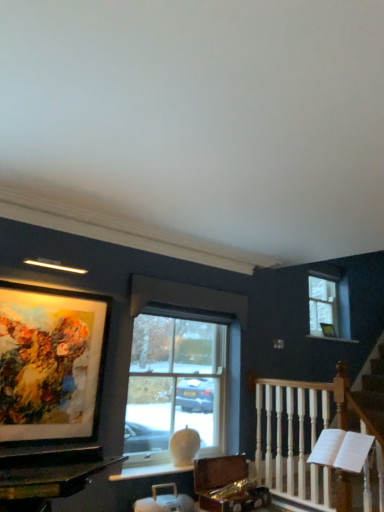
Image resolution: width=384 pixels, height=512 pixels. What do you see at coordinates (328, 306) in the screenshot?
I see `clear glass window at upper right, which is the first window in right-to-left order` at bounding box center [328, 306].

Image resolution: width=384 pixels, height=512 pixels. In order to click on matte glass picture frame at upper left in this screenshot , I will do `click(48, 365)`.

Identify the location of white wooden railing at right. The width and height of the screenshot is (384, 512). (317, 440).

In order to click on clear glass window at upper right, the 2th window viewed from the front in this screenshot , I will do `click(328, 306)`.

Which is behind, white wooden railing at right or white marble window sill at upper center?

white marble window sill at upper center is behind.

Is white wooden railing at right positioned far away from white marble window sill at upper center?

Absolutely, white wooden railing at right is distant from white marble window sill at upper center.

The image size is (384, 512). I want to click on window sill that appears behind the white wooden railing at right, so click(333, 338).

Who is shorter, white marble window sill at upper center or clear glass window at center, which is counted as the 1th window, starting from the left?

Standing shorter between the two is white marble window sill at upper center.

Does point (310, 337) appear closer or farther from the camera than point (227, 410)?

Point (310, 337) is farther from the camera than point (227, 410).

This screenshot has height=512, width=384. Identify the location of window below the white marble window sill at upper center (from a real-world perspective). (182, 370).

Can you confirm if white marble window sill at upper center is thinner than clear glass window at center, which is the 2th window from right to left?

Incorrect, the width of white marble window sill at upper center is not less than that of clear glass window at center, which is the 2th window from right to left.

You are a GUI agent. You are given a task and a screenshot of the screen. Output one action in this format:
    pyautogui.click(x=<x>, y=<y>)
    Task: Click on the picture frame in front of the clear glass window at center, acting as the 1th window starting from the front
    The width and height of the screenshot is (384, 512).
    Given the screenshot: What is the action you would take?
    pyautogui.click(x=48, y=365)

Is point (71, 308) behind point (131, 390)?

No, it is in front of (131, 390).

Can you see matte glass picture frame at upper left touching clear glass window at center, which is the 2th window from right to left?

matte glass picture frame at upper left and clear glass window at center, which is the 2th window from right to left, are not in contact.

From the image's perspective, is matte glass picture frame at upper left above or below clear glass window at center, acting as the 1th window starting from the front?

matte glass picture frame at upper left is situated higher than clear glass window at center, acting as the 1th window starting from the front, in the image.

From a real-world perspective, which is physically above, matte glass picture frame at upper left or white marble window sill at upper center?

white marble window sill at upper center.

What's the angular difference between matte glass picture frame at upper left and white marble window sill at upper center's facing directions?

The angular difference between matte glass picture frame at upper left and white marble window sill at upper center is 0.00898 degrees.

Looking at this image, which object is further away from the camera taking this photo, matte glass picture frame at upper left or white marble window sill at upper center?

white marble window sill at upper center.

Would you say matte glass picture frame at upper left is to the left or to the right of white marble window sill at upper center in the picture?

In the image, matte glass picture frame at upper left appears on the left side of white marble window sill at upper center.

How far apart are white marble window sill at upper center and matte glass picture frame at upper left?

The distance of white marble window sill at upper center from matte glass picture frame at upper left is 9.56 feet.

Does point (317, 336) come farther from viewer compared to point (94, 403)?

Yes, point (317, 336) is behind point (94, 403).

From a real-world perspective, which is physically above, white marble window sill at upper center or matte glass picture frame at upper left?

white marble window sill at upper center.

Would you say clear glass window at center, which is the 2th window from right to left, is to the left or to the right of white wooden railing at right in the picture?

clear glass window at center, which is the 2th window from right to left, is to the left of white wooden railing at right.

From a real-world perspective, who is located lower, clear glass window at center, which is counted as the 1th window, starting from the left, or white wooden railing at right?

From a 3D spatial view, white wooden railing at right is below.

Based on the photo, can we say clear glass window at center, which is counted as the 1th window, starting from the left, lies outside white wooden railing at right?

Indeed, clear glass window at center, which is counted as the 1th window, starting from the left, is completely outside white wooden railing at right.

Is clear glass window at center, which is the 2th window from right to left, aimed at white wooden railing at right?

Yes, clear glass window at center, which is the 2th window from right to left, is oriented towards white wooden railing at right.

In the scene shown: Is white wooden railing at right oriented towards matte glass picture frame at upper left?

No, white wooden railing at right is not aimed at matte glass picture frame at upper left.

Which object is closer to the camera taking this photo, white wooden railing at right or matte glass picture frame at upper left?

Positioned in front is matte glass picture frame at upper left.

Identify the location of rail below the matte glass picture frame at upper left (from the image's perspective). (317, 440).

Find the location of `rail below the white marble window sill at upper center (from the image's perspective)`. rail below the white marble window sill at upper center (from the image's perspective) is located at coordinates (317, 440).

What are the coordinates of `window in front of the white marble window sill at upper center` in the screenshot? It's located at (182, 370).

Based on their spatial positions, is matte glass picture frame at upper left or clear glass window at center, the 2th window viewed from the back, further from white wooden railing at right?

matte glass picture frame at upper left lies further to white wooden railing at right than the other object.

When comparing their distances from clear glass window at center, acting as the 1th window starting from the front, does clear glass window at upper right, the 2th window positioned from the left, or white marble window sill at upper center seem further?

white marble window sill at upper center lies further to clear glass window at center, acting as the 1th window starting from the front, than the other object.

Estimate the real-world distances between objects in this image. Which object is further from clear glass window at upper right, which is the first window from back to front, clear glass window at center, which is the 2th window from right to left, or white wooden railing at right?

clear glass window at center, which is the 2th window from right to left, lies further to clear glass window at upper right, which is the first window from back to front, than the other object.

Looking at the image, which one is located closer to clear glass window at center, which is counted as the 1th window, starting from the left, matte glass picture frame at upper left or white marble window sill at upper center?

matte glass picture frame at upper left lies closer to clear glass window at center, which is counted as the 1th window, starting from the left, than the other object.

Based on their spatial positions, is white marble window sill at upper center or white wooden railing at right further from matte glass picture frame at upper left?

Based on the image, white marble window sill at upper center appears to be further to matte glass picture frame at upper left.

Based on their spatial positions, is clear glass window at center, acting as the 1th window starting from the front, or white marble window sill at upper center further from white wooden railing at right?

Among the two, white marble window sill at upper center is located further to white wooden railing at right.

Looking at the image, which one is located further to white marble window sill at upper center, clear glass window at center, which is counted as the 1th window, starting from the left, or white wooden railing at right?

Among the two, clear glass window at center, which is counted as the 1th window, starting from the left, is located further to white marble window sill at upper center.

Estimate the real-world distances between objects in this image. Which object is closer to matte glass picture frame at upper left, clear glass window at upper right, which is the first window from back to front, or white marble window sill at upper center?

clear glass window at upper right, which is the first window from back to front, lies closer to matte glass picture frame at upper left than the other object.

The image size is (384, 512). What are the coordinates of `window sill between matte glass picture frame at upper left and clear glass window at upper right, which is the first window from back to front, in the horizontal direction` in the screenshot? It's located at 333,338.

I want to click on rail located between matte glass picture frame at upper left and clear glass window at upper right, which is the first window from back to front, in the depth direction, so click(317, 440).

I want to click on window between white wooden railing at right and clear glass window at upper right, the 2th window positioned from the left, in the front-back direction, so click(x=182, y=370).

Locate an element on the screen. This screenshot has height=512, width=384. window located between matte glass picture frame at upper left and white wooden railing at right in the left-right direction is located at coordinates (182, 370).